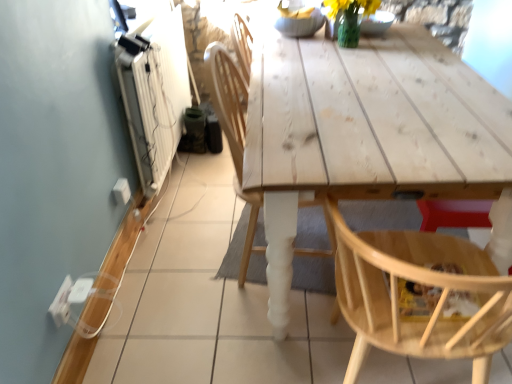
Question: Is white plastic electric outlet at lower left, placed as the second electric outlet when sorted from bottom to top, taller than wooden chair at center, acting as the 1th chair starting from the left?

Choices:
 (A) no
 (B) yes

Answer: (A)

Question: Is the depth of white plastic electric outlet at lower left, arranged as the 2th electric outlet when viewed from the front, greater than that of wooden chair at center, acting as the 1th chair starting from the left?

Choices:
 (A) no
 (B) yes

Answer: (B)

Question: From the image's perspective, is white plastic electric outlet at lower left, the first electric outlet when ordered from top to bottom, below wooden chair at center, acting as the 1th chair starting from the left?

Choices:
 (A) yes
 (B) no

Answer: (A)

Question: From a real-world perspective, is white plastic electric outlet at lower left, arranged as the first electric outlet when viewed from the right, located higher than wooden chair at center, acting as the 1th chair starting from the left?

Choices:
 (A) yes
 (B) no

Answer: (B)

Question: Does white plastic electric outlet at lower left, acting as the 1th electric outlet starting from the back, turn towards wooden chair at center, acting as the 1th chair starting from the left?

Choices:
 (A) no
 (B) yes

Answer: (B)

Question: Is white plastic electric outlet at lower left, the second electric outlet positioned from the back, taller or shorter than natural wood chair at lower right, placed as the 1th chair when sorted from right to left?

Choices:
 (A) tall
 (B) short

Answer: (B)

Question: From the image's perspective, is white plastic electric outlet at lower left, marked as the 1th electric outlet in a front-to-back arrangement, located above or below natural wood chair at lower right, the second chair positioned from the left?

Choices:
 (A) below
 (B) above

Answer: (A)

Question: Considering the positions of point (61, 289) and point (471, 269), is point (61, 289) closer or farther from the camera than point (471, 269)?

Choices:
 (A) farther
 (B) closer

Answer: (A)

Question: Which is correct: white plastic electric outlet at lower left, marked as the 1th electric outlet in a front-to-back arrangement, is inside natural wood chair at lower right, placed as the 1th chair when sorted from right to left, or outside of it?

Choices:
 (A) inside
 (B) outside

Answer: (B)

Question: Relative to wooden chair at center, the 2th chair when ordered from right to left, is natural wood chair at lower right, the second chair positioned from the left, in front or behind?

Choices:
 (A) front
 (B) behind

Answer: (A)

Question: From the image's perspective, relative to wooden chair at center, acting as the 1th chair starting from the left, is natural wood chair at lower right, placed as the 1th chair when sorted from right to left, above or below?

Choices:
 (A) below
 (B) above

Answer: (A)

Question: Is natural wood chair at lower right, the second chair positioned from the left, wider or thinner than wooden chair at center, acting as the 1th chair starting from the left?

Choices:
 (A) wide
 (B) thin

Answer: (A)

Question: Do you think natural wood chair at lower right, the second chair positioned from the left, is within wooden chair at center, acting as the 1th chair starting from the left, or outside of it?

Choices:
 (A) inside
 (B) outside

Answer: (B)

Question: From a real-world perspective, is white plastic electric outlet at lower left, the first electric outlet when ordered from top to bottom, physically located above or below white plastic electric outlet at lower left, the second electric outlet positioned from the back?

Choices:
 (A) above
 (B) below

Answer: (B)

Question: Looking at the image, does white plastic electric outlet at lower left, which is the second electric outlet in left-to-right order, seem bigger or smaller compared to white plastic electric outlet at lower left, which is counted as the 1th electric outlet, starting from the left?

Choices:
 (A) big
 (B) small

Answer: (A)